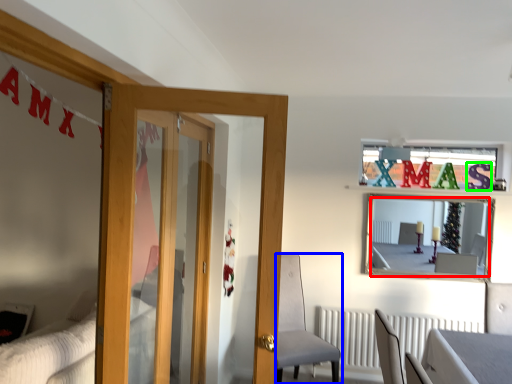
Question: Which object is the closest to the mirror (highlighted by a red box)? Choose among these: chair (highlighted by a blue box) or letter (highlighted by a green box).

Choices:
 (A) chair
 (B) letter

Answer: (B)